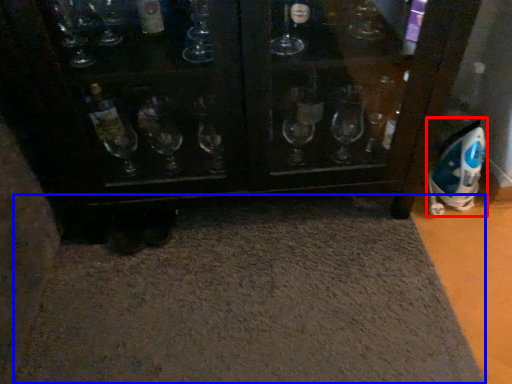
Question: Which of the following is the closest to the observer, appliance (highlighted by a red box) or bath mat (highlighted by a blue box)?

Choices:
 (A) appliance
 (B) bath mat

Answer: (B)